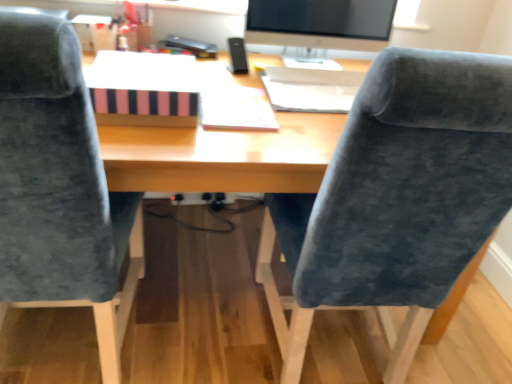
Question: From a real-world perspective, is white paper at upper center, which ranks as the second book in left-to-right order, physically located above or below velvet blue chair at left, which is counted as the 2th chair, starting from the right?

Choices:
 (A) above
 (B) below

Answer: (A)

Question: Looking at their shapes, would you say white paper at upper center, positioned as the 1th book in right-to-left order, is wider or thinner than velvet blue chair at left, which is counted as the first chair, starting from the left?

Choices:
 (A) wide
 (B) thin

Answer: (B)

Question: Which is farther from the white paper at center?

Choices:
 (A) satin black monitor at upper center
 (B) pink striped paper at center, positioned as the first book in left-to-right order
 (C) white paper at upper center, which ranks as the second book in left-to-right order
 (D) velvet blue chair at right, which is the first chair from right to left
 (E) velvet blue chair at left, which is counted as the 2th chair, starting from the right

Answer: (A)

Question: Based on their relative distances, which object is farther from the pink striped paper at center, positioned as the second book in right-to-left order?

Choices:
 (A) black plastic remote at center
 (B) velvet blue chair at right, which is the first chair from right to left
 (C) white paper at center
 (D) white paper at upper center, positioned as the 1th book in right-to-left order
 (E) satin black monitor at upper center

Answer: (E)